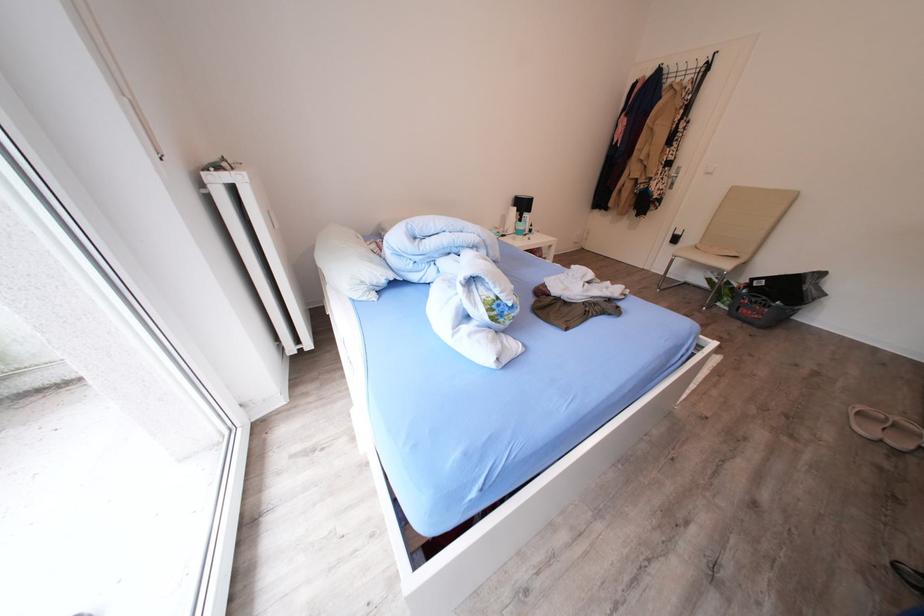
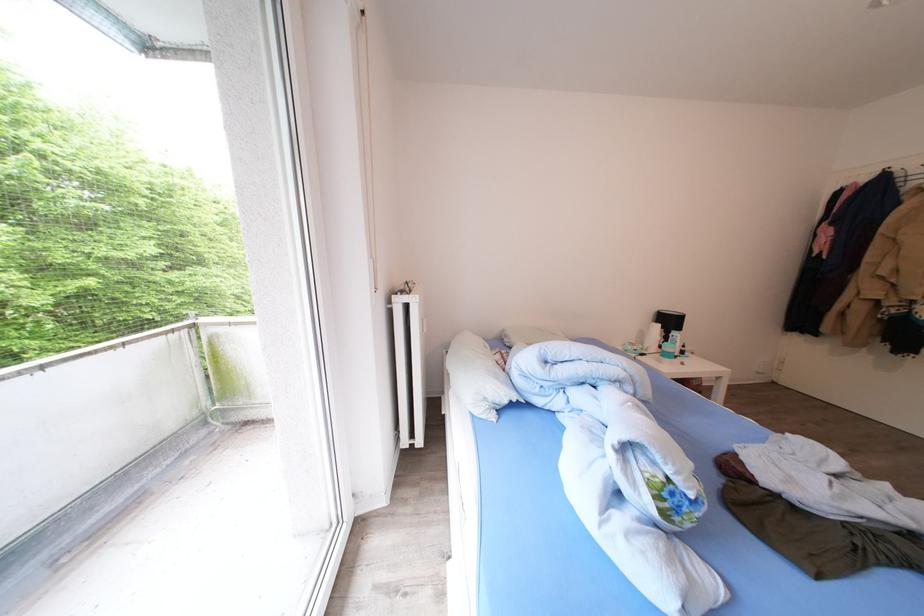
Where in the second image is the point corresponding to pixel 531 209 from the first image?

(677, 326)